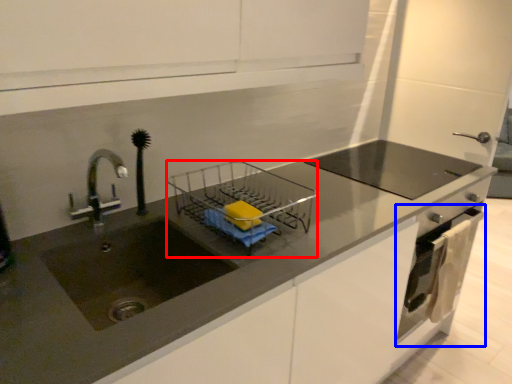
Question: Which object appears closest to the camera in this image, appliance (highlighted by a red box) or oven (highlighted by a blue box)?

Choices:
 (A) appliance
 (B) oven

Answer: (A)